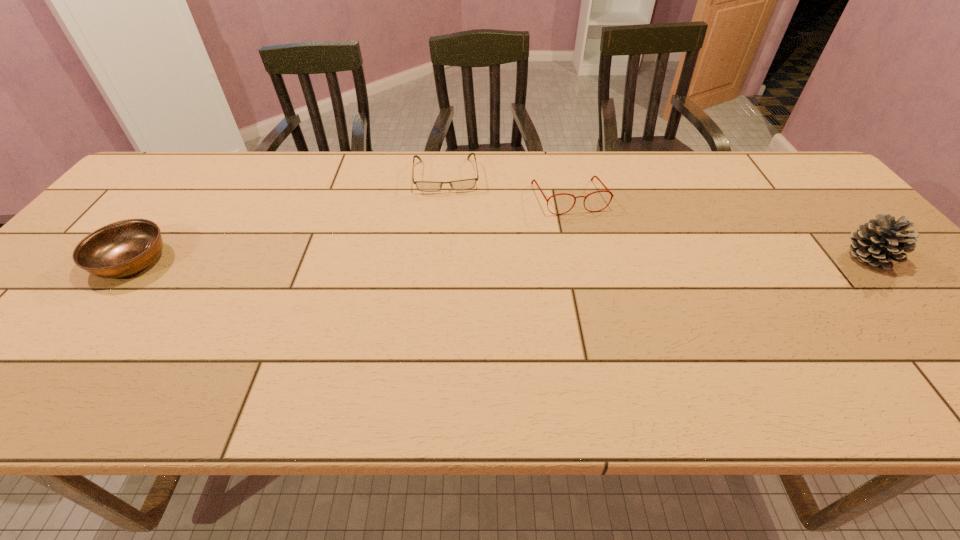
This screenshot has width=960, height=540. In order to click on vacant region located 0.190m on the front-facing side of the third object from right to left in this screenshot , I will do `click(450, 238)`.

This screenshot has height=540, width=960. Find the location of `vacant space positioned 0.220m on the front-facing side of the third object from right to left`. vacant space positioned 0.220m on the front-facing side of the third object from right to left is located at coordinates (450, 246).

Find the location of `vacant space positioned 0.130m on the front-facing side of the third object from right to left`. vacant space positioned 0.130m on the front-facing side of the third object from right to left is located at coordinates (449, 224).

At what (x,y) coordinates should I click in order to perform the action: click on free space located 0.080m on the face of the right spectacles. Please return your answer as a coordinate pair (x, y). Looking at the image, I should click on (588, 235).

Find the location of `vacant region located on the face of the right spectacles`. vacant region located on the face of the right spectacles is located at coordinates (610, 282).

You are a GUI agent. You are given a task and a screenshot of the screen. Output one action in this format:
    pyautogui.click(x=<x>, y=<y>)
    Task: Click on the free space located on the face of the right spectacles
    The width and height of the screenshot is (960, 540).
    Given the screenshot: What is the action you would take?
    pyautogui.click(x=595, y=251)

I want to click on object that is at the left edge, so click(122, 248).

Where is `object located in the right edge section of the desktop`? object located in the right edge section of the desktop is located at coordinates (877, 242).

You are a GUI agent. You are given a task and a screenshot of the screen. Output one action in this format:
    pyautogui.click(x=<x>, y=<y>)
    Task: Click on the vacant region at the far edge of the desktop
    
    Given the screenshot: What is the action you would take?
    pyautogui.click(x=444, y=165)

The width and height of the screenshot is (960, 540). Find the location of `vacant space at the near edge`. vacant space at the near edge is located at coordinates (351, 339).